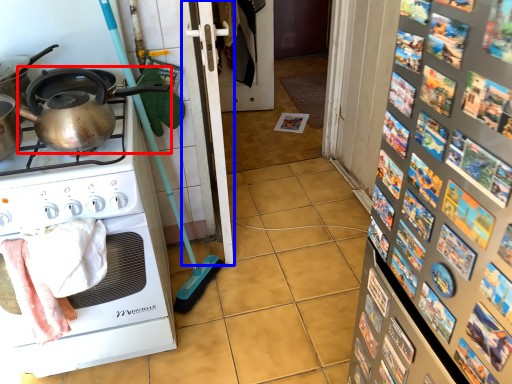
Question: Which point is further to the camera, kettle (highlighted by a red box) or screen door (highlighted by a blue box)?

Choices:
 (A) kettle
 (B) screen door

Answer: (B)